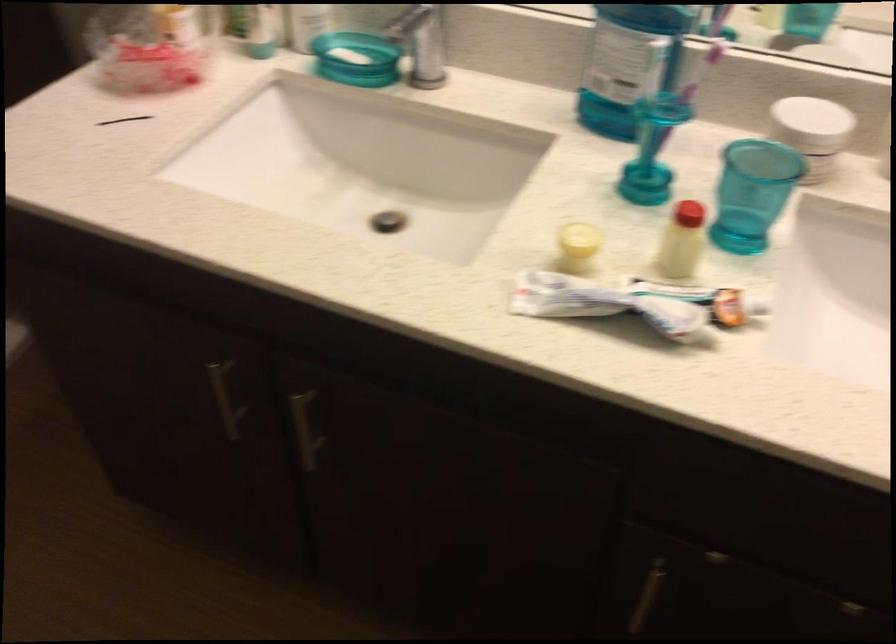
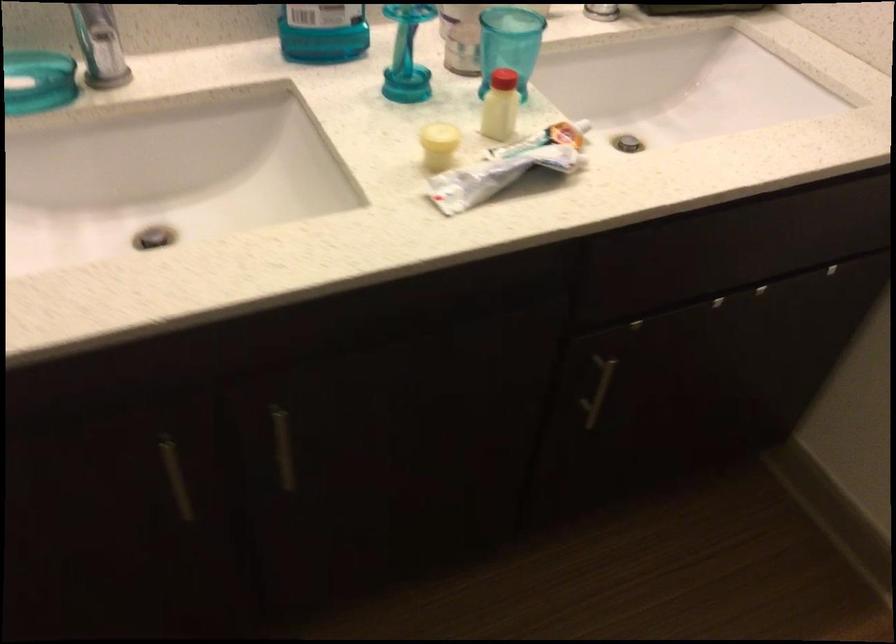
Where in the second image is the point corresponding to (x=228, y=398) from the first image?

(176, 477)